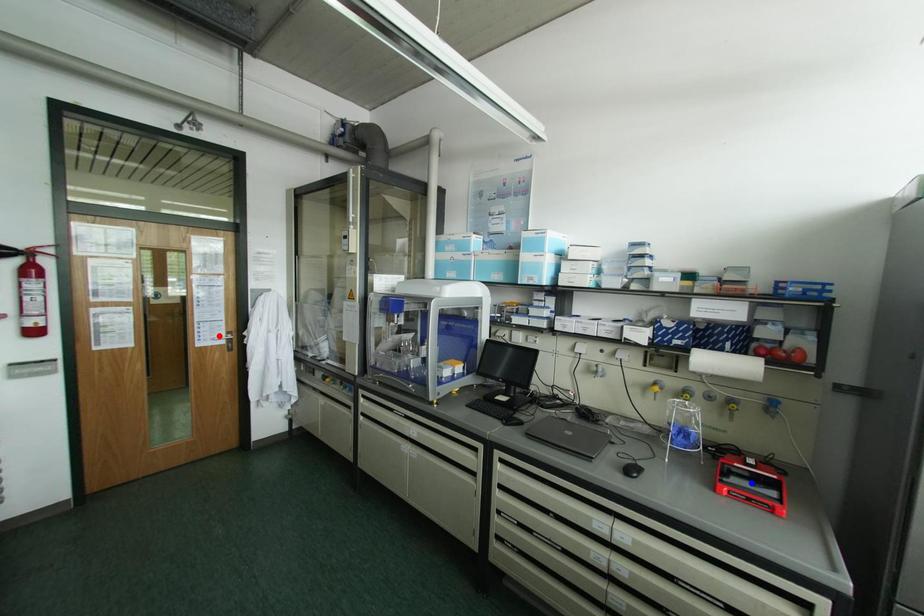
Question: In the image, two points are highlighted. Which point is nearer to the camera? Reply with the corresponding letter.

Choices:
 (A) blue point
 (B) red point

Answer: (A)